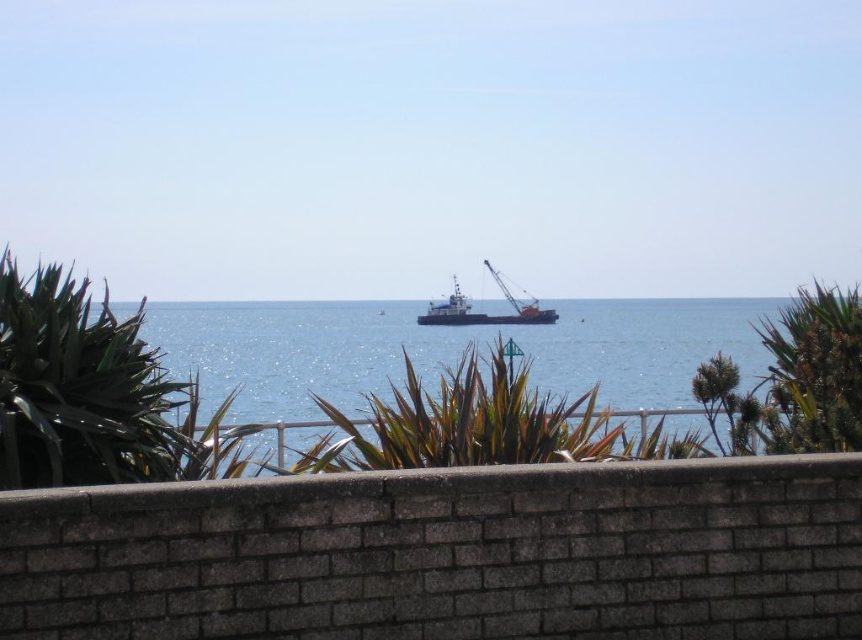
Measure the distance between blue water at center and orange matte cargo ship at center.

blue water at center and orange matte cargo ship at center are 10.85 meters apart from each other.

Is blue water at center positioned before orange matte cargo ship at center?

That is True.

The height and width of the screenshot is (640, 862). What do you see at coordinates (294, 346) in the screenshot?
I see `blue water at center` at bounding box center [294, 346].

Image resolution: width=862 pixels, height=640 pixels. In order to click on blue water at center in this screenshot , I will do `click(294, 346)`.